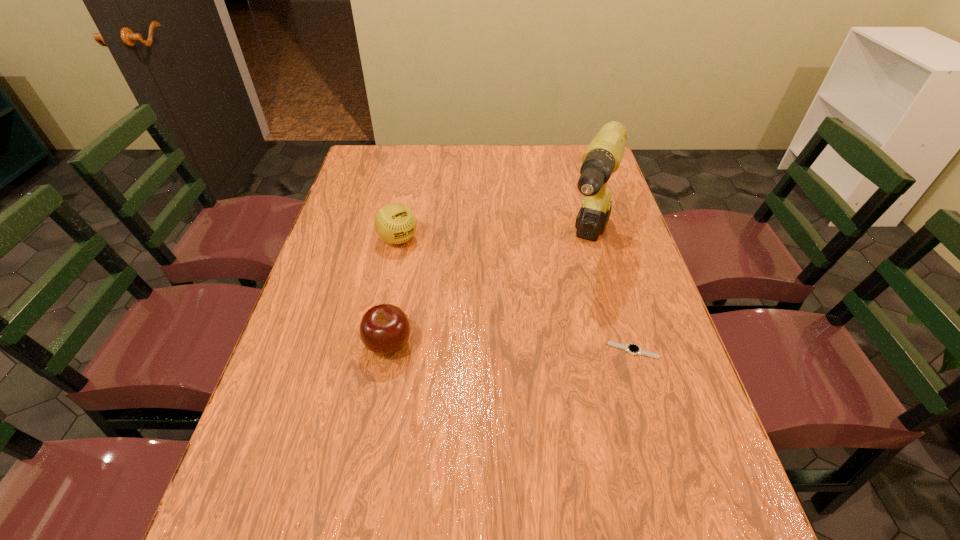
What are the coordinates of `free space on the desktop that is between the apple and the shortest object and is positioned on the handle side of the tallest object` in the screenshot? It's located at (544, 348).

I want to click on vacant spot on the desktop that is between the apple and the watch and is positioned on the logo side of the softball, so click(x=500, y=347).